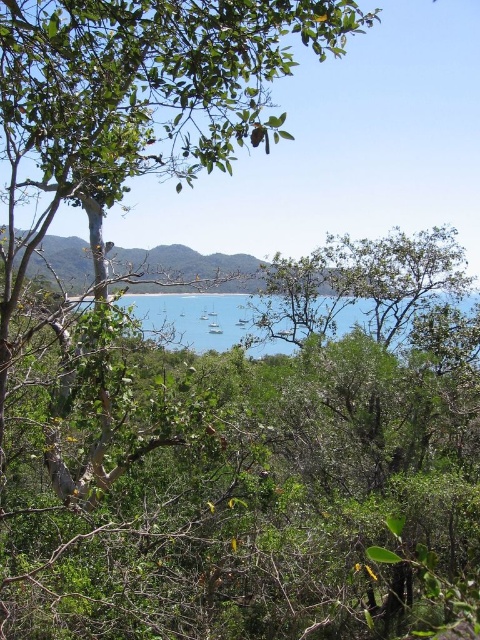
You are an observer standing in the coastal landscape. You see the green leafy tree at upper left and the blue water at center. Which object is closer to you based on their positions?

The green leafy tree at upper left is closer to you because it is positioned over the blue water at center, indicating it is in a foreground layer.

You are standing in the coastal landscape scene and want to walk towards the point at coordinates point (x=286, y=17). As you move forward, will you encounter the point at coordinates point (x=200, y=307) before reaching your destination?

Point (x=286, y=17) is in front of point (x=200, y=307), so you will reach the point at coordinates point (x=286, y=17) before encountering point (x=200, y=307).